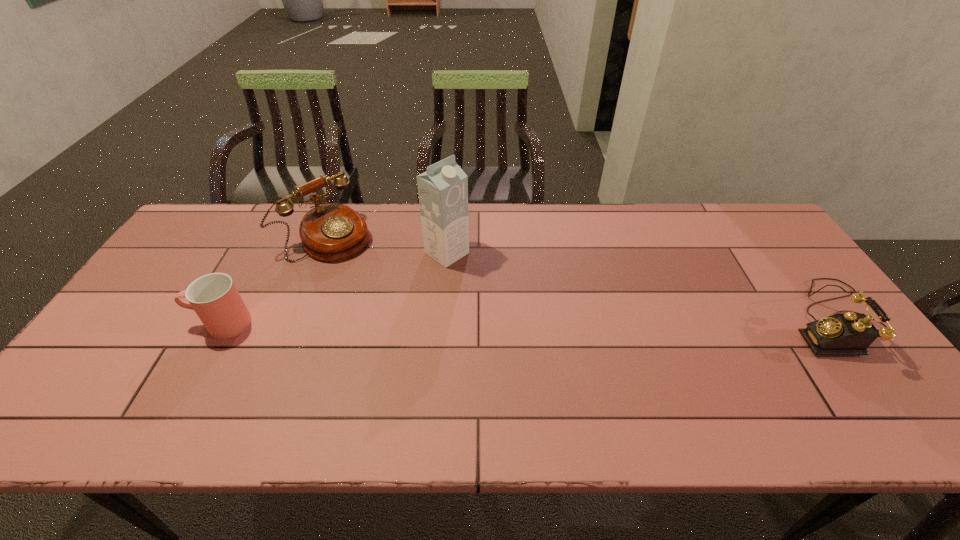
Locate an element on the screen. vacant space located on the dial of the shorter telephone is located at coordinates (693, 319).

Identify the location of vacant space situated 0.170m on the dial of the shorter telephone. This screenshot has width=960, height=540. (723, 319).

At what (x,y) coordinates should I click in order to perform the action: click on blank space located 0.320m on the dial of the shorter telephone. Please return your answer as a coordinate pair (x, y). The height and width of the screenshot is (540, 960). Looking at the image, I should click on (666, 319).

Identify the location of vacant space situated 0.120m on the dial of the taller telephone. The width and height of the screenshot is (960, 540). (378, 273).

This screenshot has width=960, height=540. I want to click on vacant point located on the dial of the taller telephone, so tap(384, 278).

The height and width of the screenshot is (540, 960). Identify the location of free space located on the dial of the taller telephone. (436, 318).

The width and height of the screenshot is (960, 540). Identify the location of vacant position located 0.180m on the front label of the tallest object. (506, 294).

Identify the location of vacant area located 0.110m on the front label of the tallest object. (489, 282).

Where is `vacant region located 0.050m on the front label of the tallest object`? vacant region located 0.050m on the front label of the tallest object is located at coordinates (474, 272).

At what (x,y) coordinates should I click in order to perform the action: click on telephone situated at the far edge. Please return your answer as a coordinate pair (x, y). Looking at the image, I should click on (331, 232).